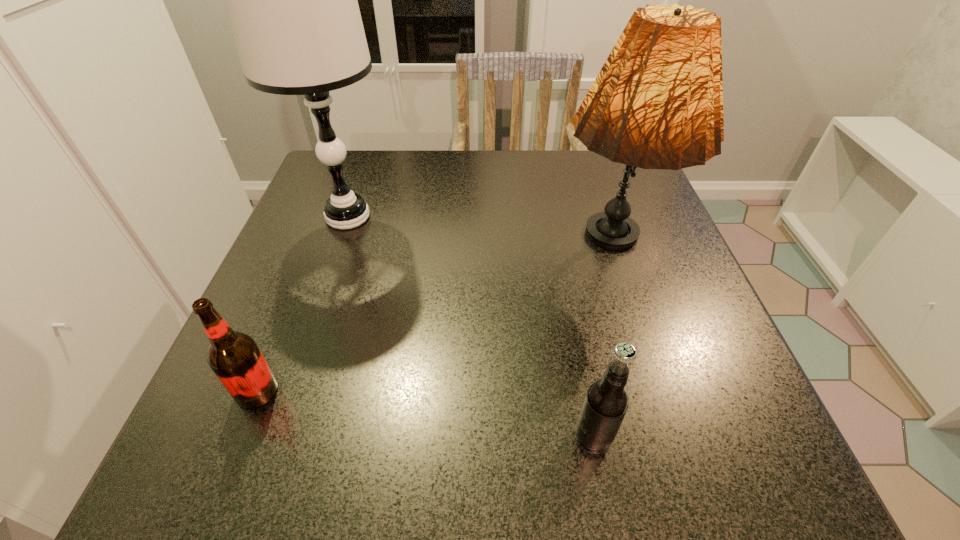
The image size is (960, 540). In order to click on free space located 0.190m on the label of the nearest object in this screenshot , I will do `click(439, 437)`.

Find the location of a particular element. The width and height of the screenshot is (960, 540). vacant position located 0.270m on the back of the third farthest object is located at coordinates (311, 258).

Locate an element on the screen. object located at the far edge is located at coordinates (291, 0).

Find the location of a particular element. The width and height of the screenshot is (960, 540). object situated at the near edge is located at coordinates (606, 402).

Where is `table lamp at the left edge`? table lamp at the left edge is located at coordinates (291, 0).

The width and height of the screenshot is (960, 540). I want to click on root beer that is positioned at the left edge, so click(234, 357).

This screenshot has width=960, height=540. I want to click on object that is positioned at the right edge, so click(x=657, y=103).

Identify the location of object present at the far left corner. (291, 0).

At what (x,y) coordinates should I click in order to perform the action: click on vacant space at the far edge of the desktop. Please return your answer as a coordinate pair (x, y). This screenshot has width=960, height=540. Looking at the image, I should click on (413, 159).

At what (x,y) coordinates should I click in order to perform the action: click on vacant space at the near edge. Please return your answer as a coordinate pair (x, y). Looking at the image, I should click on (566, 433).